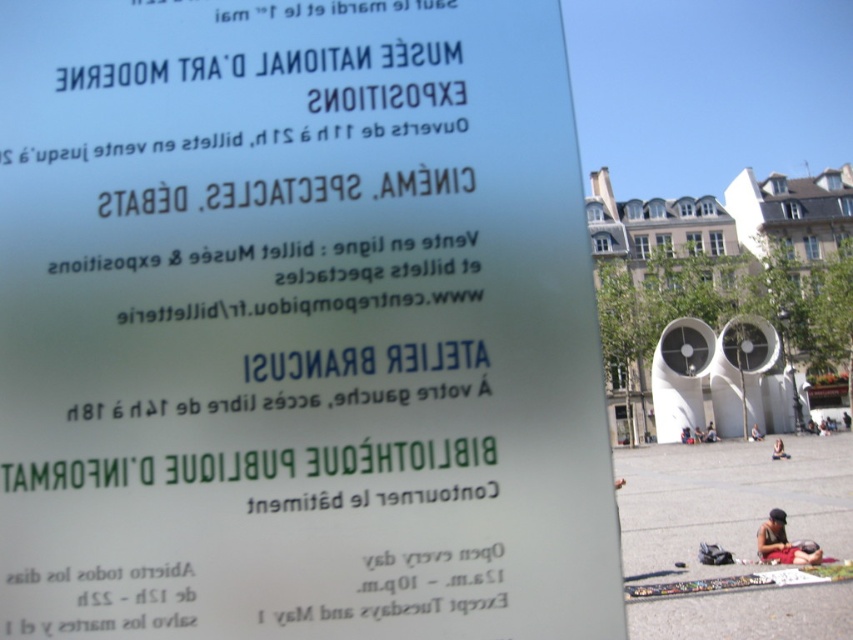
Question: Which object is farther from the camera taking this photo?

Choices:
 (A) dark blue jeans at center
 (B) dark blue fabric at center

Answer: (B)

Question: From the image, what is the correct spatial relationship of dark blue fabric at lower right in relation to dark blue jeans at center?

Choices:
 (A) below
 (B) above

Answer: (B)

Question: Which object is the farthest from the brown leather jacket at lower right?

Choices:
 (A) transparent glass sign at upper center
 (B) dark blue fabric at center
 (C) dark blue jeans at lower center
 (D) dark blue fabric at lower right

Answer: (B)

Question: Which of the following is the farthest from the observer?

Choices:
 (A) dark blue jeans at lower center
 (B) transparent glass sign at upper center

Answer: (A)

Question: Does transparent glass sign at upper center have a smaller size compared to dark blue jeans at lower center?

Choices:
 (A) no
 (B) yes

Answer: (B)

Question: Can you confirm if dark blue fabric at lower right is positioned below dark blue jeans at center?

Choices:
 (A) yes
 (B) no

Answer: (B)